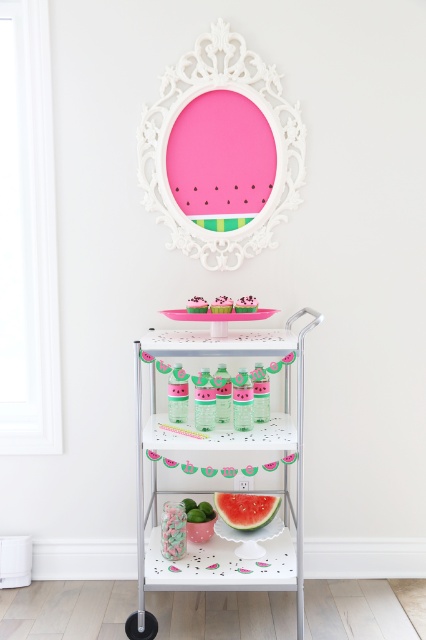
Can you confirm if black rubber wheel at lower left is shorter than green matte lime at center?

Incorrect, black rubber wheel at lower left's height does not fall short of green matte lime at center's.

Can you confirm if black rubber wheel at lower left is bigger than green matte lime at center?

Yes.

Who is more distant from viewer, [135,634] or [213,515]?

Positioned behind is point [213,515].

In order to click on black rubber wheel at lower left in this screenshot , I will do `click(141, 625)`.

Between black rubber wheel at lower left and green matte lime at lower center, which one is positioned lower?

Positioned lower is black rubber wheel at lower left.

Between point (146, 614) and point (198, 515), which one is positioned in front?

Point (146, 614) is in front.

Find the location of `black rubber wheel at lower left`. black rubber wheel at lower left is located at coordinates (141, 625).

Can you confirm if green matte lime at lower center is positioned to the right of green matte lime at center?

Incorrect, green matte lime at lower center is not on the right side of green matte lime at center.

Find the location of a particular element. Image resolution: width=426 pixels, height=640 pixels. green matte lime at lower center is located at coordinates (195, 515).

I want to click on green matte lime at lower center, so click(x=195, y=515).